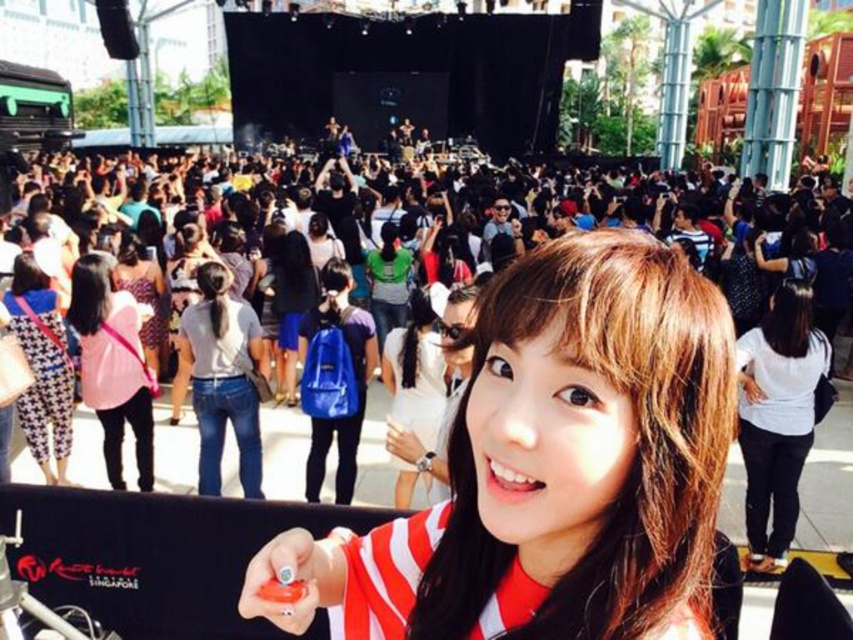
Question: Which point is closer to the camera?

Choices:
 (A) click(218, 440)
 (B) click(786, 532)
 (C) click(125, 381)

Answer: (B)

Question: Does white matte shirt at center appear under houndstooth fabric pants at center?

Choices:
 (A) yes
 (B) no

Answer: (A)

Question: Among these objects, which one is farthest from the camera?

Choices:
 (A) houndstooth fabric pants at center
 (B) matte black crowd at center
 (C) matte red striped shirt at center

Answer: (A)

Question: Is matte red striped shirt at center behind white cotton shirt at center?

Choices:
 (A) no
 (B) yes

Answer: (A)

Question: Which is farther from the white cotton shirt at center?

Choices:
 (A) pink fabric bag at center
 (B) white matte shirt at center

Answer: (B)

Question: From the image, what is the correct spatial relationship of white cotton shirt at center in relation to houndstooth fabric pants at center?

Choices:
 (A) above
 (B) below

Answer: (B)